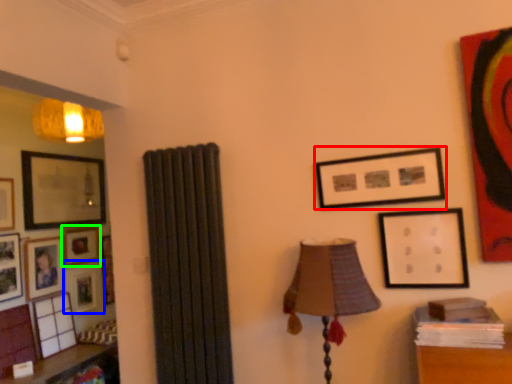
Question: Based on their relative distances, which object is nearer to picture frame (highlighted by a red box)? Choose from picture frame (highlighted by a blue box) and picture frame (highlighted by a green box).

Choices:
 (A) picture frame
 (B) picture frame

Answer: (B)